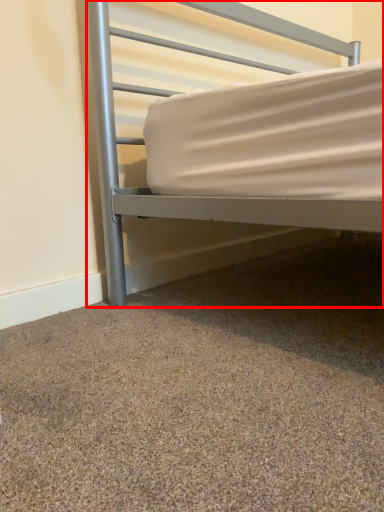
Question: From the image's perspective, what is the correct spatial positioning of bed (annotated by the red box) in reference to granite?

Choices:
 (A) above
 (B) below

Answer: (A)